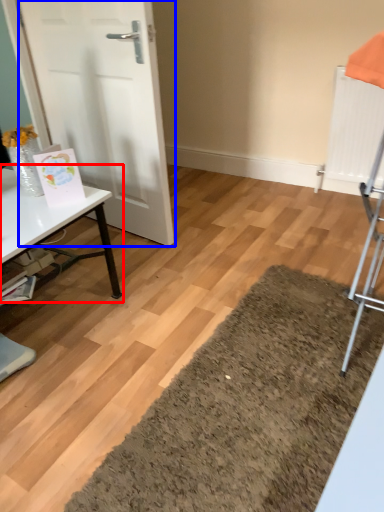
Question: Which object is further to the camera taking this photo, table (highlighted by a red box) or door (highlighted by a blue box)?

Choices:
 (A) table
 (B) door

Answer: (B)